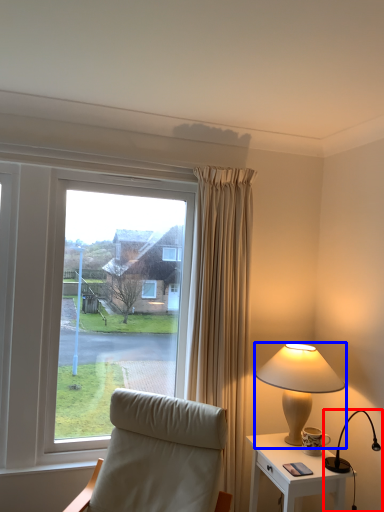
Question: Which object appears farthest to the camera in this image, lamp (highlighted by a red box) or lamp (highlighted by a blue box)?

Choices:
 (A) lamp
 (B) lamp

Answer: (B)